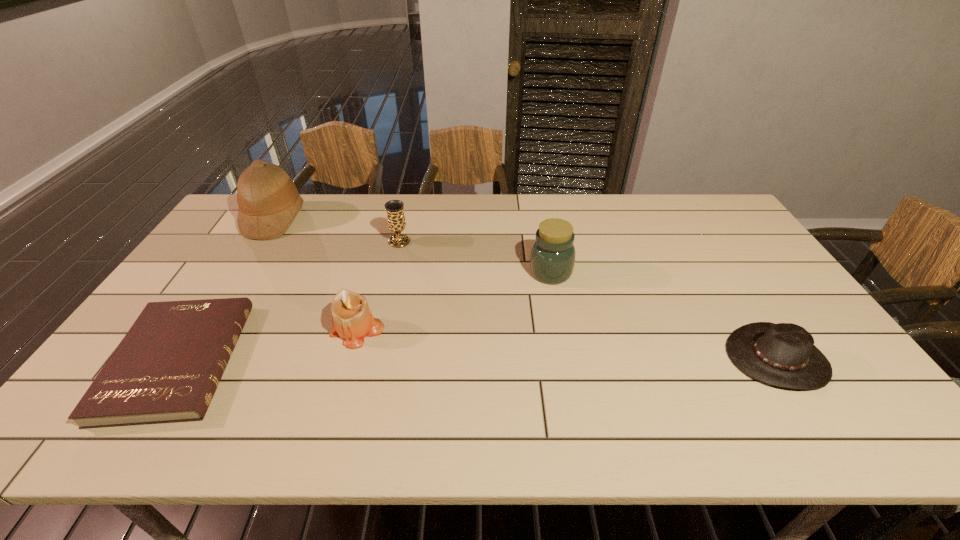
Locate an element on the screen. This screenshot has width=960, height=540. object present at the near left corner is located at coordinates (166, 369).

Find the location of a particular element. The width and height of the screenshot is (960, 540). vacant space at the far edge is located at coordinates (599, 208).

I want to click on free location at the near edge of the desktop, so [248, 424].

Find the location of a particular element. free region at the left edge of the desktop is located at coordinates (189, 286).

This screenshot has height=540, width=960. In the image, there is a desktop. Identify the location of vacant space at the right edge. (797, 325).

You are a GUI agent. You are given a task and a screenshot of the screen. Output one action in this format:
    pyautogui.click(x=<x>, y=<y>)
    Task: Click on the vacant region at the far left corner of the desktop
    Image resolution: width=960 pixels, height=540 pixels.
    Given the screenshot: What is the action you would take?
    pyautogui.click(x=233, y=220)

In order to click on vacant space at the far right corner of the desktop in this screenshot , I will do `click(674, 198)`.

At what (x,y) coordinates should I click in order to perform the action: click on free space between the hardback book and the taller hat. Please return your answer as a coordinate pair (x, y). This screenshot has height=540, width=960. Looking at the image, I should click on (227, 290).

Identify the location of free space between the candle and the jar. (454, 302).

The width and height of the screenshot is (960, 540). I want to click on free space that is in between the candle and the shortest object, so click(267, 346).